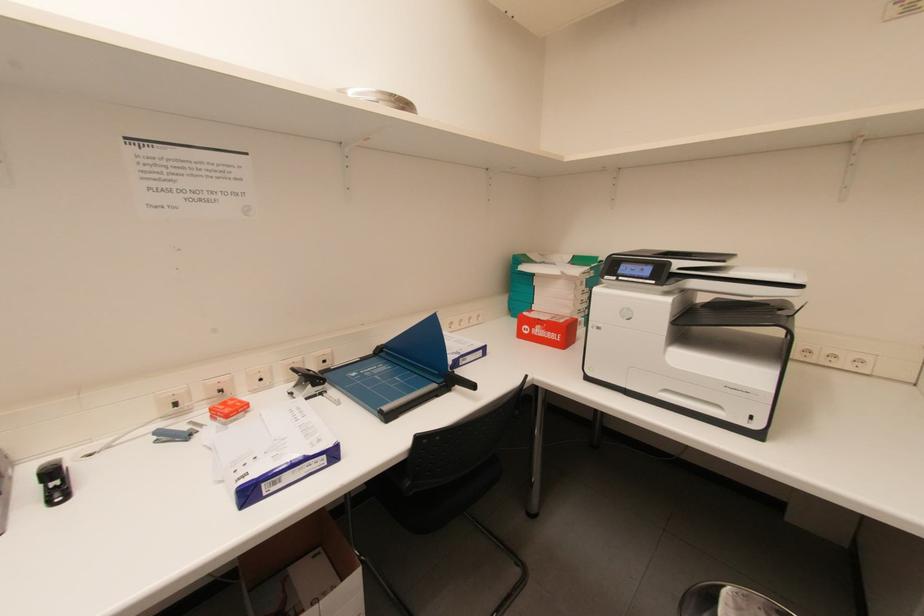
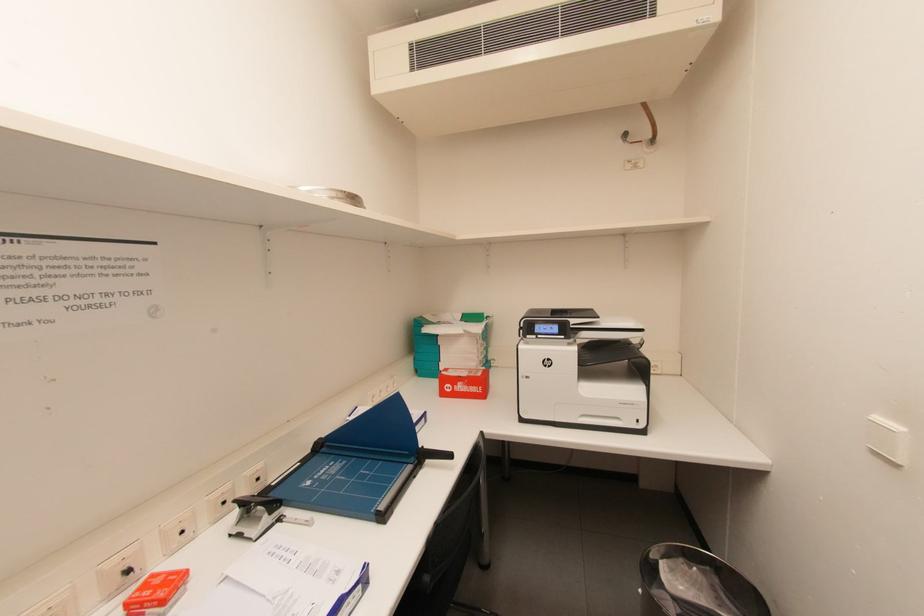
Question: The camera is either moving clockwise (left) or counter-clockwise (right) around the object. The first image is from the beginning of the video and the second image is from the end. Is the camera moving left or right when shooting the video?

Choices:
 (A) Left
 (B) Right

Answer: (A)